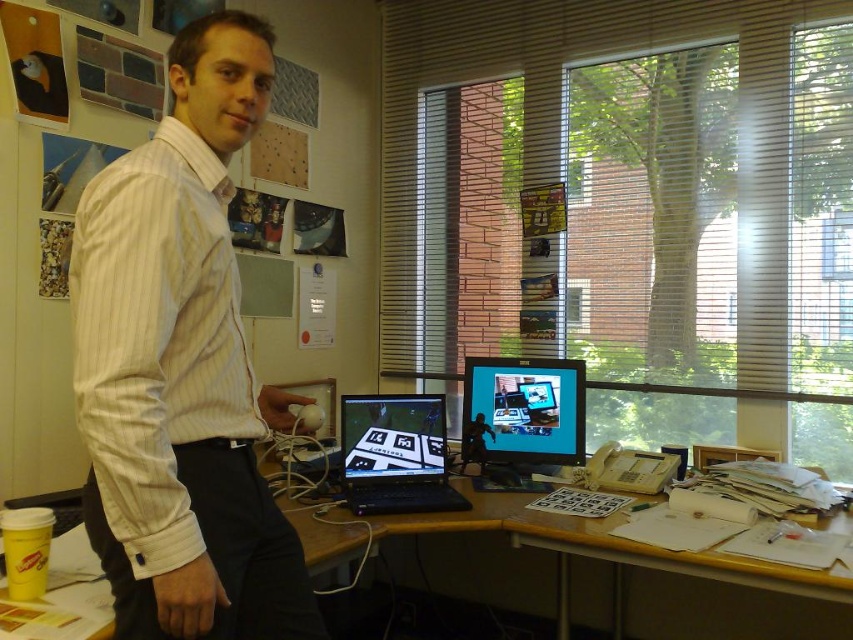
Which is more to the right, white striped shirt at center or matte black computer monitor at center?

matte black computer monitor at center

Which is in front, point (223, 120) or point (483, 420)?

Positioned in front is point (223, 120).

In order to click on white striped shirt at center in this screenshot , I will do [x=183, y=368].

Can you confirm if white striped shirt at center is taller than wooden desk at center?

Yes.

From the picture: Does white striped shirt at center have a lesser height compared to wooden desk at center?

Incorrect, white striped shirt at center's height does not fall short of wooden desk at center's.

Identify the location of white striped shirt at center. This screenshot has width=853, height=640. (183, 368).

Is matte black computer monitor at center above black glossy laptop at center?

Yes.

Between matte black computer monitor at center and black glossy laptop at center, which one is positioned lower?

black glossy laptop at center is below.

This screenshot has width=853, height=640. Describe the element at coordinates (523, 412) in the screenshot. I see `matte black computer monitor at center` at that location.

At what (x,y) coordinates should I click in order to perform the action: click on matte black computer monitor at center. Please return your answer as a coordinate pair (x, y). Looking at the image, I should click on (523, 412).